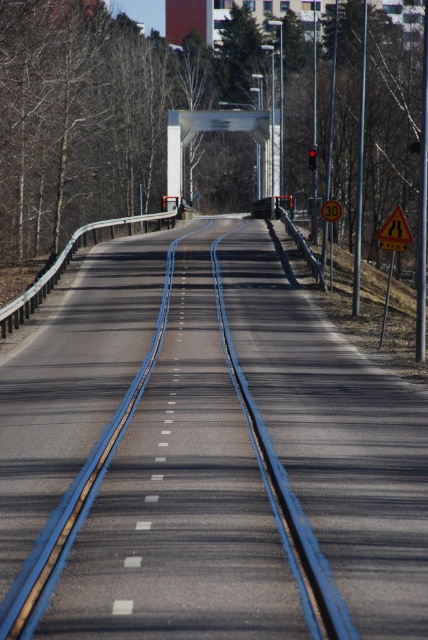
Question: Which point is farther to the camera?

Choices:
 (A) (273, 186)
 (B) (335, 204)
 (C) (404, 218)
 (D) (264, 579)

Answer: (A)

Question: Which object is positioned farthest from the brown leafless tree at center?

Choices:
 (A) metallic bridge at center
 (B) blue asphalt highway at center

Answer: (B)

Question: Is yellow reflective triangle at center behind yellow reflective plastic speed limit sign at center?

Choices:
 (A) no
 (B) yes

Answer: (A)

Question: Can you confirm if brown leafless tree at center is smaller than yellow reflective triangle at center?

Choices:
 (A) no
 (B) yes

Answer: (A)

Question: Which object is the farthest from the yellow reflective triangle at center?

Choices:
 (A) brown leafless tree at center
 (B) yellow reflective plastic speed limit sign at center
 (C) blue asphalt highway at center
 (D) metallic bridge at center

Answer: (A)

Question: Is blue asphalt highway at center bigger than yellow reflective triangle at center?

Choices:
 (A) yes
 (B) no

Answer: (A)